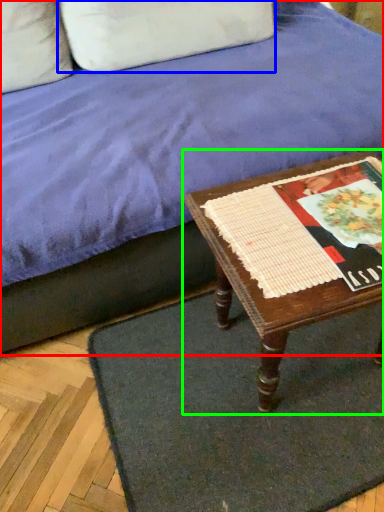
Question: Considering the real-world distances, which object is farthest from studio couch (highlighted by a red box)? pillow (highlighted by a blue box) or table (highlighted by a green box)?

Choices:
 (A) pillow
 (B) table

Answer: (A)